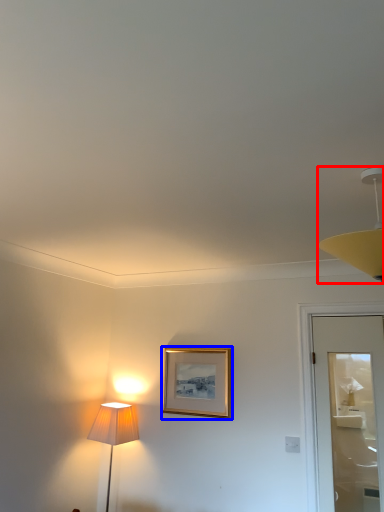
Question: Which object is closer to the camera taking this photo, lamp (highlighted by a red box) or picture frame (highlighted by a blue box)?

Choices:
 (A) lamp
 (B) picture frame

Answer: (A)